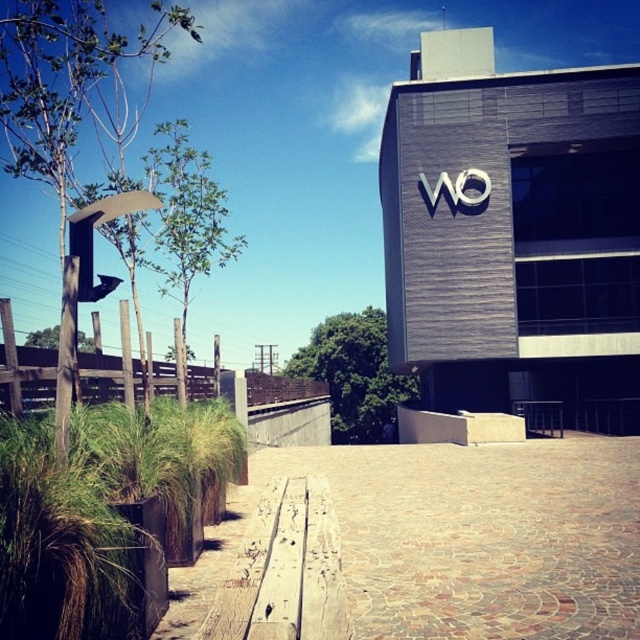
Is brown textured pavement at center wider than green grass at lower left?

Indeed, brown textured pavement at center has a greater width compared to green grass at lower left.

In order to click on brown textured pavement at center in this screenshot , I will do `click(483, 536)`.

Find the location of `brown textured pavement at center`. brown textured pavement at center is located at coordinates (483, 536).

Where is `brown textured pavement at center`? brown textured pavement at center is located at coordinates (483, 536).